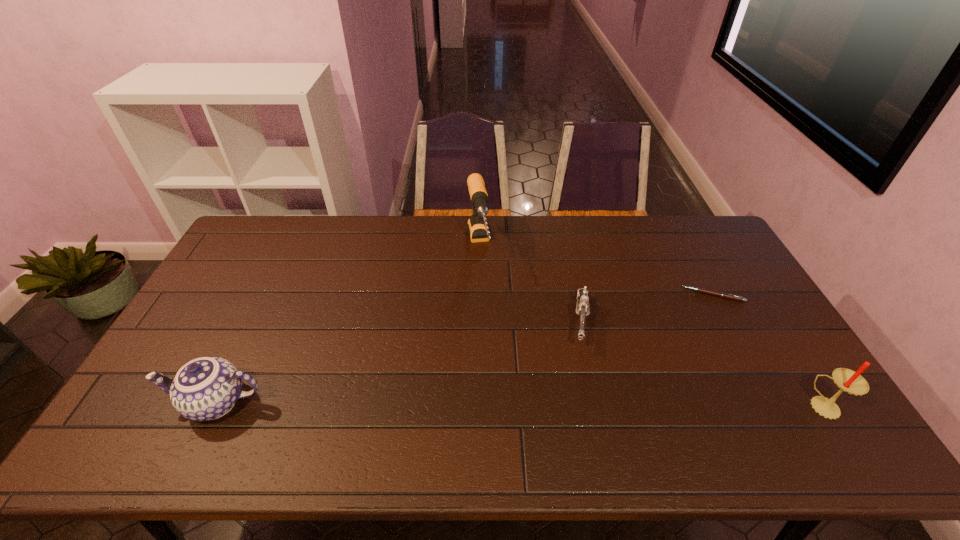
At what (x,y) coordinates should I click in order to perform the action: click on the third shortest object. Please return your answer as a coordinate pair (x, y). This screenshot has width=960, height=540. Looking at the image, I should click on (207, 388).

I want to click on chinaware, so click(207, 388).

Find the location of a particular element. the rightmost object is located at coordinates (847, 380).

The height and width of the screenshot is (540, 960). Identify the location of gun. (582, 309).

I want to click on the fourth tallest object, so click(582, 309).

The height and width of the screenshot is (540, 960). I want to click on the fourth object from left to right, so click(720, 294).

Image resolution: width=960 pixels, height=540 pixels. Identify the location of the shortest object. (720, 294).

Where is `the second object from left to right`? This screenshot has width=960, height=540. the second object from left to right is located at coordinates (478, 230).

Identify the location of drill. The height and width of the screenshot is (540, 960). (478, 230).

The width and height of the screenshot is (960, 540). Identify the location of blank space located at the spout of the chinaware. (144, 402).